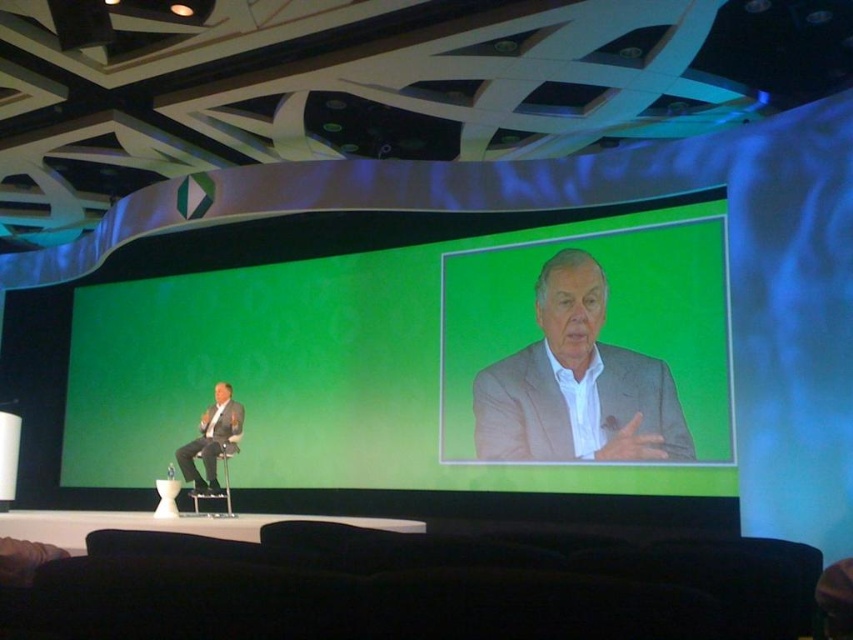
Does green matte/projection screen at center have a smaller size compared to gray suit at center?

Correct, green matte/projection screen at center occupies less space than gray suit at center.

Does point (416, 308) lie behind point (625, 424)?

Yes, point (416, 308) is behind point (625, 424).

The height and width of the screenshot is (640, 853). In order to click on green matte/projection screen at center in this screenshot , I will do `click(395, 349)`.

Who is more distant from viewer, (380,465) or (196,506)?

Point (196,506)

Is green matte/projection screen at center shorter than metallic silver chair at left?

Correct, green matte/projection screen at center is not as tall as metallic silver chair at left.

Which is in front, point (248, 385) or point (207, 492)?

Point (207, 492) is more forward.

Identify the location of green matte/projection screen at center. The height and width of the screenshot is (640, 853). (395, 349).

Who is lower down, green matte/projection screen at center or matte gray suit at center?

matte gray suit at center

What do you see at coordinates (395, 349) in the screenshot? I see `green matte/projection screen at center` at bounding box center [395, 349].

The height and width of the screenshot is (640, 853). What do you see at coordinates (395, 349) in the screenshot?
I see `green matte/projection screen at center` at bounding box center [395, 349].

In order to click on green matte/projection screen at center in this screenshot , I will do `click(395, 349)`.